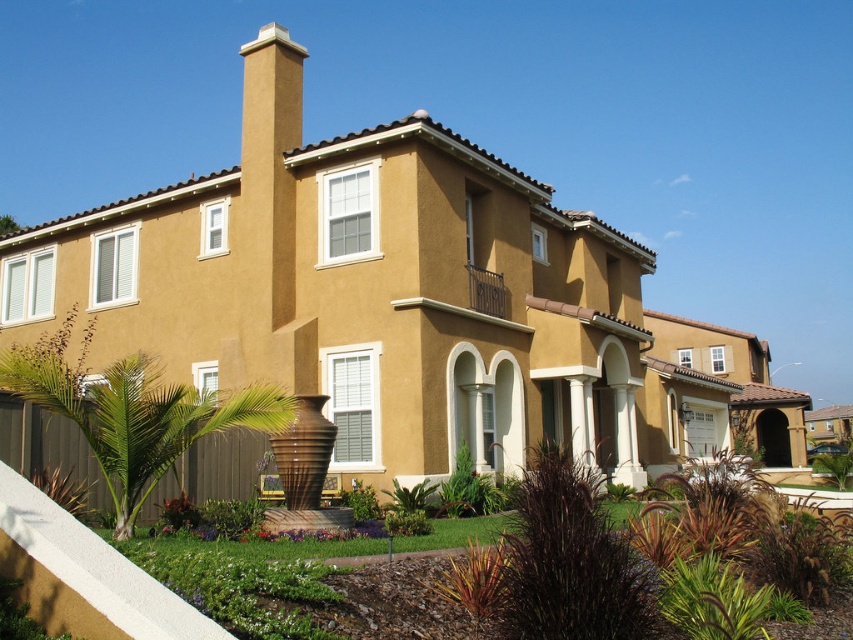
Question: Estimate the real-world distances between objects in this image. Which object is closer to the green leafy bush at center?

Choices:
 (A) green leafy plant at center
 (B) green leafy palm tree at lower left

Answer: (A)

Question: Is green leafy plant at center above green leafy bush at center?

Choices:
 (A) no
 (B) yes

Answer: (A)

Question: Is the position of green leafy palm tree at lower left less distant than that of green leafy plant at center?

Choices:
 (A) no
 (B) yes

Answer: (B)

Question: Is green leafy palm tree at lower left bigger than green leafy bush at center?

Choices:
 (A) no
 (B) yes

Answer: (B)

Question: Estimate the real-world distances between objects in this image. Which object is farther from the green leafy bush at center?

Choices:
 (A) green leafy palm tree at lower left
 (B) green leafy plant at center

Answer: (A)

Question: Which object appears closest to the camera in this image?

Choices:
 (A) green leafy bush at center
 (B) green leafy palm tree at lower left
 (C) green leafy plant at center

Answer: (B)